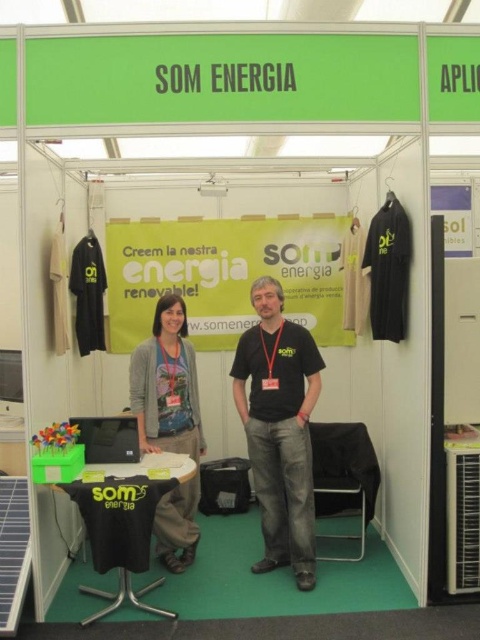
Question: Considering the real-world distances, which object is farthest from the black cotton t-shirt at center?

Choices:
 (A) matte gray sweater at center
 (B) black matte t-shirt at center
 (C) green fabric banner at center

Answer: (C)

Question: Is black cotton t-shirt at center bigger than matte gray sweater at center?

Choices:
 (A) yes
 (B) no

Answer: (A)

Question: Is green fabric banner at center above black cotton t-shirt at center?

Choices:
 (A) no
 (B) yes

Answer: (B)

Question: Which point is closer to the camera?

Choices:
 (A) black matte t-shirt at center
 (B) green fabric banner at center

Answer: (A)

Question: Where is black cotton t-shirt at center located in relation to matte gray sweater at center in the image?

Choices:
 (A) below
 (B) above

Answer: (B)

Question: Which point appears closest to the camera in this image?

Choices:
 (A) (178, 524)
 (B) (253, 344)

Answer: (A)